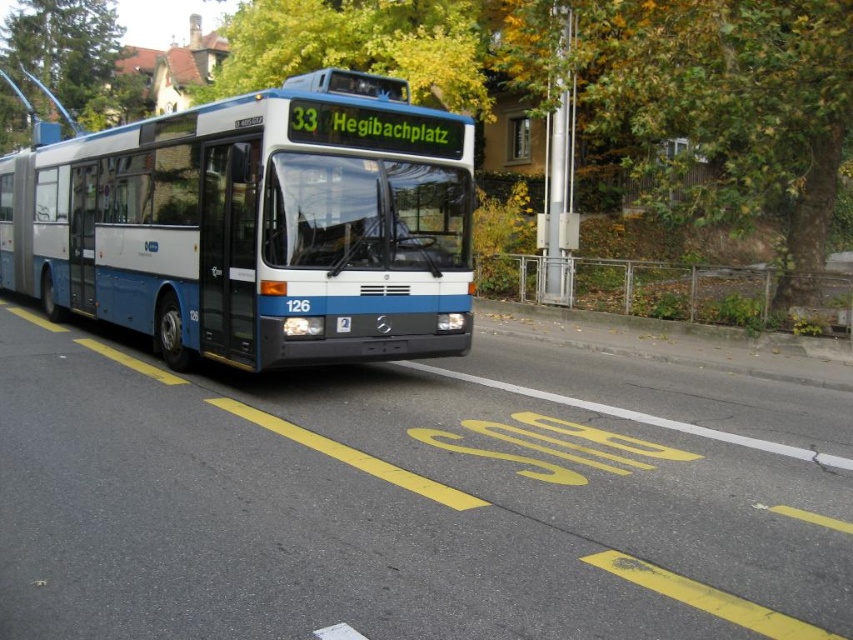
Question: Is blue metallic bus at center to the left of blue metallic license plate at center from the viewer's perspective?

Choices:
 (A) yes
 (B) no

Answer: (A)

Question: Is green leafy tree at upper center closer to camera compared to blue metallic license plate at center?

Choices:
 (A) no
 (B) yes

Answer: (A)

Question: Is blue metallic bus at center closer to camera compared to green leafy tree at upper center?

Choices:
 (A) no
 (B) yes

Answer: (B)

Question: Which point is farther to the camera?

Choices:
 (A) green leafy tree at upper right
 (B) blue metallic license plate at center
 (C) green leafy tree at upper center
 (D) blue metallic bus at center

Answer: (C)

Question: Which of these objects is positioned farthest from the green leafy tree at upper center?

Choices:
 (A) green leafy tree at upper right
 (B) blue metallic bus at center

Answer: (A)

Question: Which object appears closest to the camera in this image?

Choices:
 (A) blue metallic bus at center
 (B) green leafy tree at upper center
 (C) blue metallic license plate at center
 (D) green leafy tree at upper right

Answer: (A)